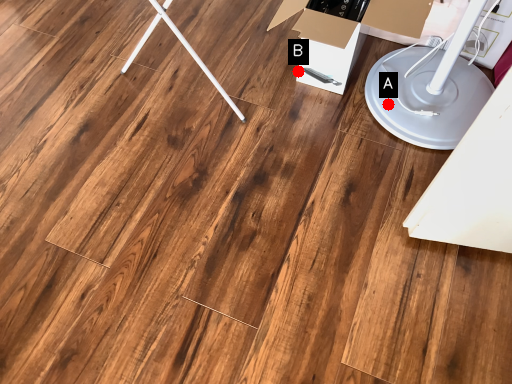
Question: Two points are circled on the image, labeled by A and B beside each circle. Which point is closer to the camera?

Choices:
 (A) A is closer
 (B) B is closer

Answer: (A)